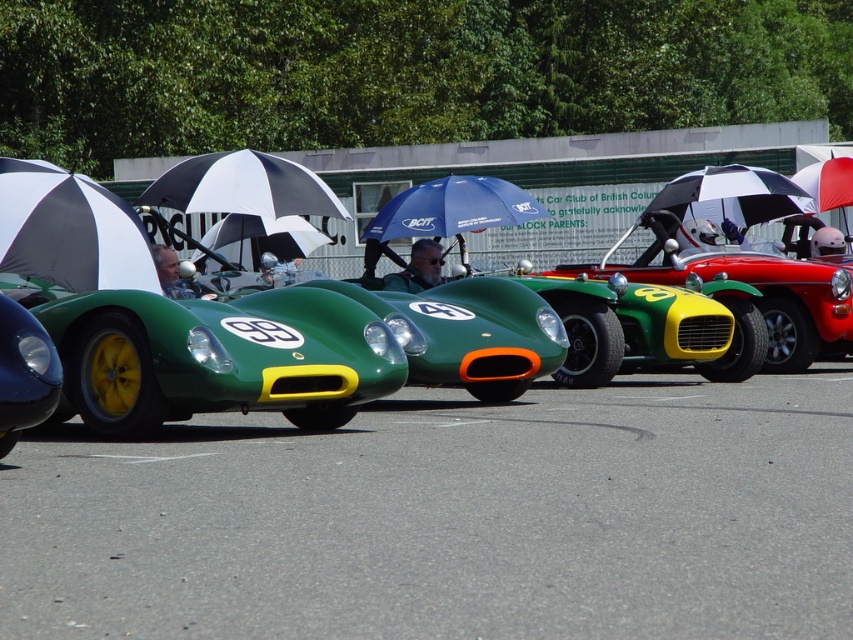
Question: Does white and black striped umbrella at center have a larger size compared to matte black helmet at center?

Choices:
 (A) yes
 (B) no

Answer: (A)

Question: Does black and white striped umbrella at center appear over matte black helmet at center?

Choices:
 (A) no
 (B) yes

Answer: (B)

Question: Which of the following is the farthest from the observer?

Choices:
 (A) matte green helmet at center
 (B) white and black striped umbrella at center
 (C) blue fabric umbrella at center

Answer: (B)

Question: Which object is positioned farthest from the black and white checkered umbrella at center?

Choices:
 (A) white/black striped umbrella at left
 (B) white and black striped umbrella at center

Answer: (A)

Question: Among these points, which one is nearest to the camera?

Choices:
 (A) (166, 282)
 (B) (378, 211)
 (C) (381, 280)

Answer: (A)

Question: From the image, what is the correct spatial relationship of white/black striped umbrella at left in relation to matte green helmet at center?

Choices:
 (A) below
 (B) above

Answer: (B)